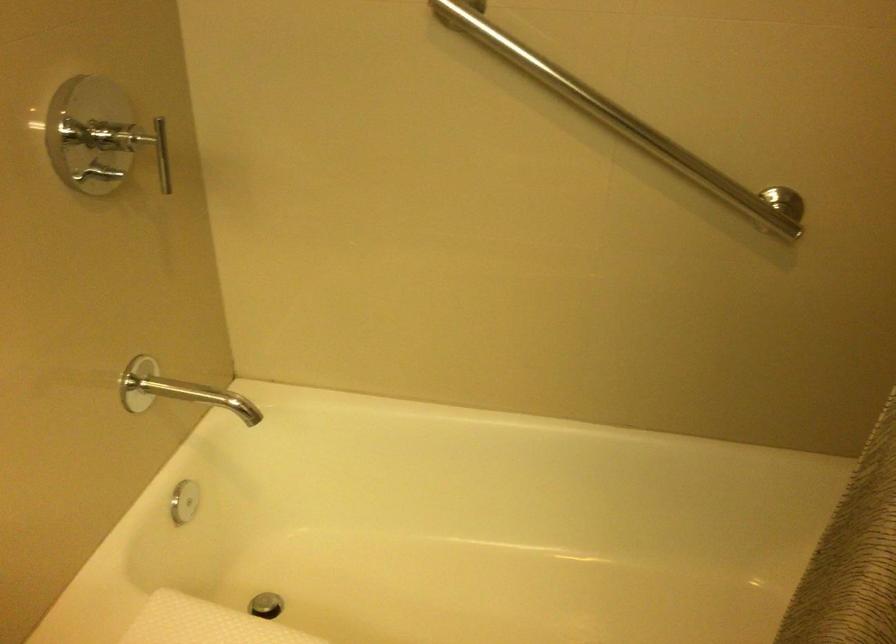
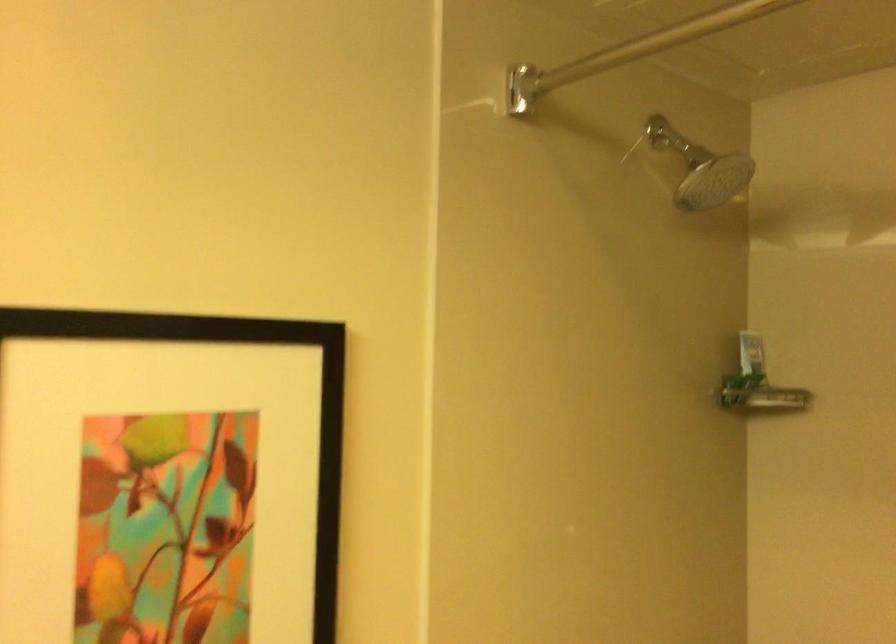
Based on the continuous images, in which direction is the camera rotating?

The camera's rotation is toward left-up.